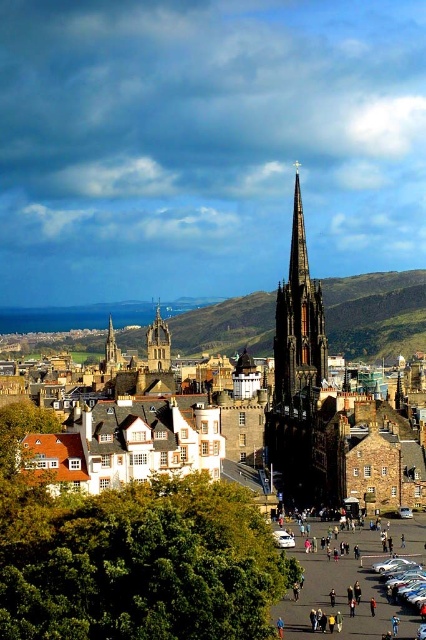
Is point (293, 317) positioned after point (147, 337)?

No.

This screenshot has width=426, height=640. Describe the element at coordinates (298, 372) in the screenshot. I see `dark brown stone spire at center` at that location.

Measure the distance between dark brown stone spire at center and camera.

dark brown stone spire at center is 157.70 meters away from camera.

Locate an element on the screen. dark brown stone spire at center is located at coordinates (298, 372).